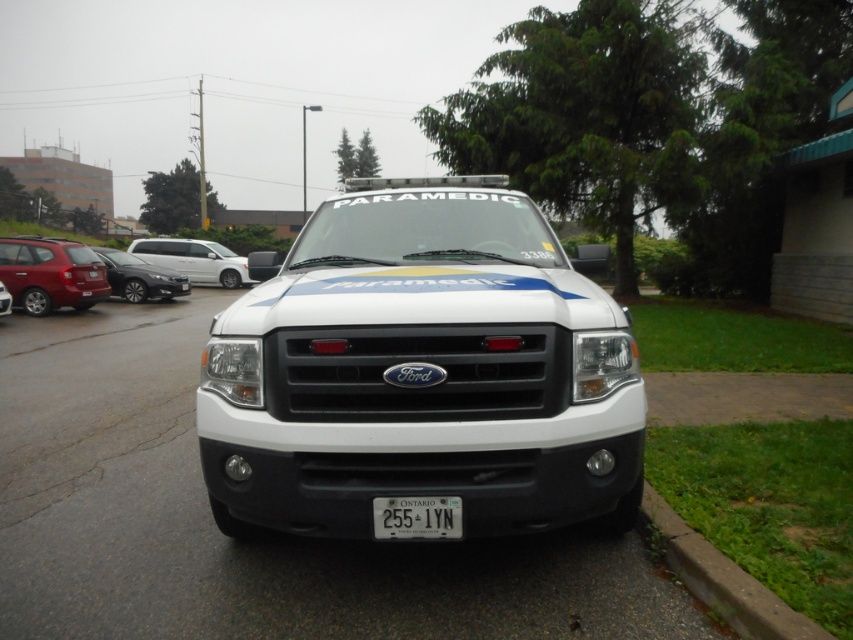
Question: Considering the relative positions of white glossy paramedic vehicle at center and matte red suv at left in the image provided, where is white glossy paramedic vehicle at center located with respect to matte red suv at left?

Choices:
 (A) left
 (B) right

Answer: (B)

Question: Which of the following is the farthest from the observer?

Choices:
 (A) (239, 275)
 (B) (415, 522)
 (C) (700, 592)
 (D) (38, 275)

Answer: (A)

Question: Which of these objects is positioned closest to the green grass at lower right?

Choices:
 (A) white glossy paramedic vehicle at center
 (B) matte red suv at left
 (C) white plastic license plate at center
 (D) matte black paramedic vehicle at center

Answer: (A)

Question: Observing the image, what is the correct spatial positioning of satin silver sedan at left in reference to matte black paramedic vehicle at center?

Choices:
 (A) below
 (B) above

Answer: (B)

Question: Can you confirm if white plastic license plate at center is bigger than matte black paramedic vehicle at center?

Choices:
 (A) no
 (B) yes

Answer: (A)

Question: Considering the real-world distances, which object is farthest from the satin silver sedan at left?

Choices:
 (A) matte black paramedic vehicle at center
 (B) green grass at lower right

Answer: (B)